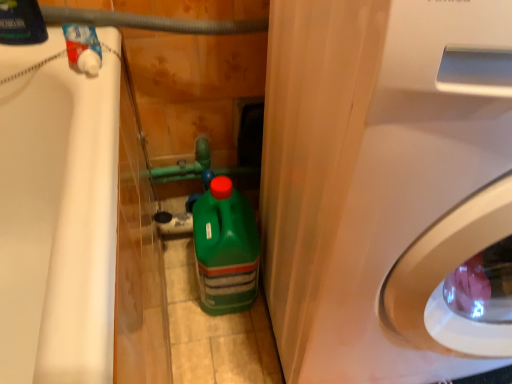
Question: Is white glossy washing machine at center right surrounded by rubber hose at upper center?

Choices:
 (A) no
 (B) yes

Answer: (A)

Question: Does rubber hose at upper center have a larger size compared to white glossy washing machine at center right?

Choices:
 (A) yes
 (B) no

Answer: (B)

Question: Can you confirm if rubber hose at upper center is shorter than white glossy washing machine at center right?

Choices:
 (A) no
 (B) yes

Answer: (B)

Question: Is rubber hose at upper center wider than white glossy washing machine at center right?

Choices:
 (A) no
 (B) yes

Answer: (A)

Question: Is rubber hose at upper center to the left of white glossy washing machine at center right from the viewer's perspective?

Choices:
 (A) yes
 (B) no

Answer: (A)

Question: Would you say rubber hose at upper center is a long distance from white glossy washing machine at center right?

Choices:
 (A) yes
 (B) no

Answer: (B)

Question: From the image's perspective, is white glossy washing machine at center right on top of rubber hose at upper center?

Choices:
 (A) yes
 (B) no

Answer: (B)

Question: Is white glossy washing machine at center right looking in the opposite direction of rubber hose at upper center?

Choices:
 (A) yes
 (B) no

Answer: (B)

Question: Is white glossy washing machine at center right completely or partially outside of rubber hose at upper center?

Choices:
 (A) no
 (B) yes

Answer: (B)

Question: Could you tell me if white glossy washing machine at center right is turned towards rubber hose at upper center?

Choices:
 (A) yes
 (B) no

Answer: (B)

Question: Does white glossy washing machine at center right have a larger size compared to rubber hose at upper center?

Choices:
 (A) no
 (B) yes

Answer: (B)

Question: Considering the relative sizes of white glossy washing machine at center right and rubber hose at upper center in the image provided, is white glossy washing machine at center right thinner than rubber hose at upper center?

Choices:
 (A) no
 (B) yes

Answer: (A)

Question: Can you confirm if green plastic bottle at center is thinner than rubber hose at upper center?

Choices:
 (A) yes
 (B) no

Answer: (B)